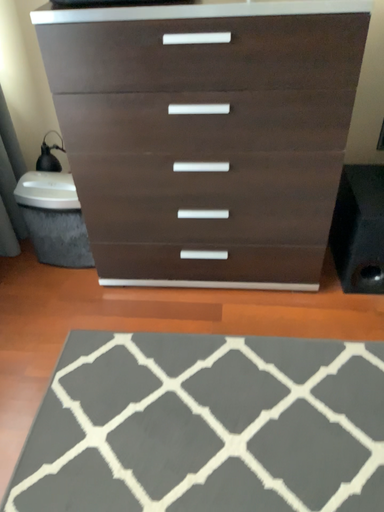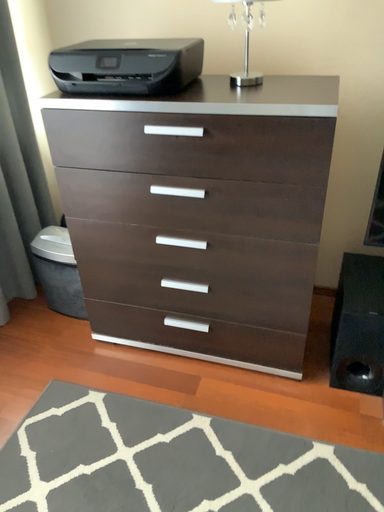
Question: How did the camera likely rotate when shooting the video?

Choices:
 (A) rotated upward
 (B) rotated downward

Answer: (A)